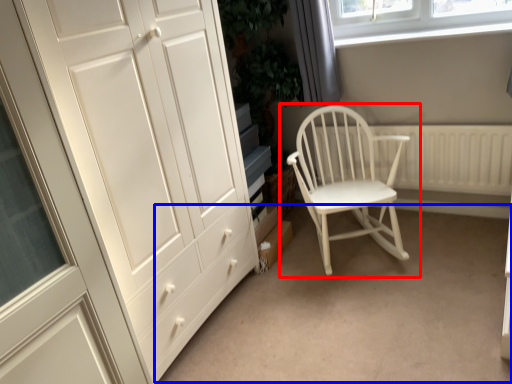
Question: Which object appears farthest to the camera in this image, chair (highlighted by a red box) or plain (highlighted by a blue box)?

Choices:
 (A) chair
 (B) plain

Answer: (A)